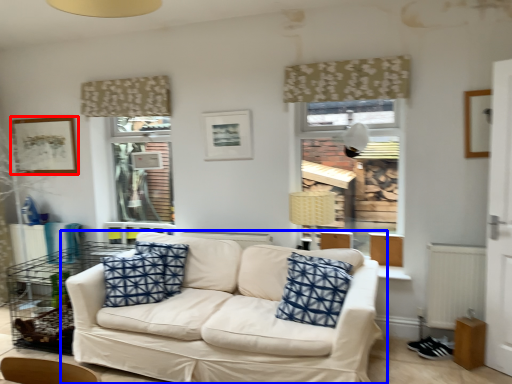
Question: Which point is closer to the camera, picture frame (highlighted by a red box) or studio couch (highlighted by a blue box)?

Choices:
 (A) picture frame
 (B) studio couch

Answer: (B)